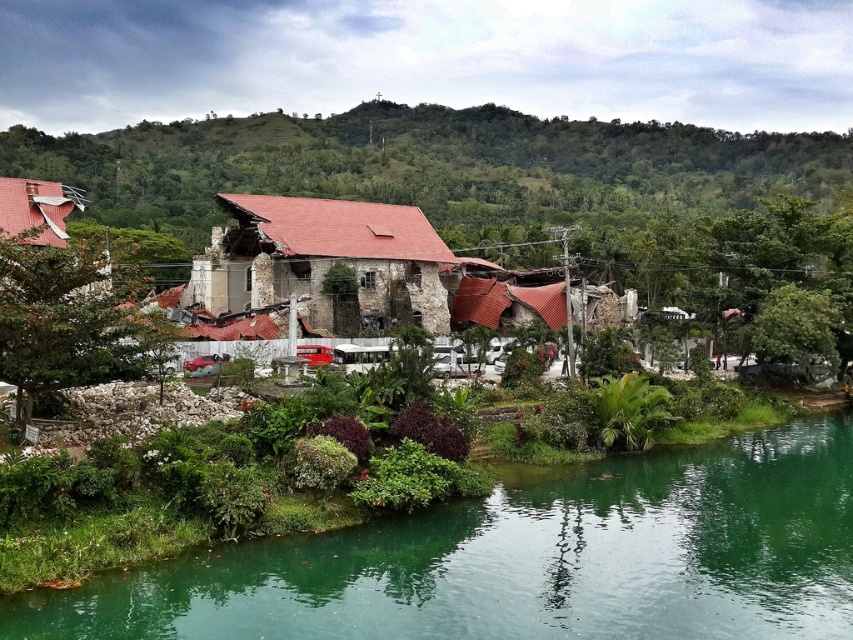
You are a drone operator trying to capture aerial footage of the demolished building. Your drone has a maximum flight range of 25 meters. If you are positioned at the camera location, can your drone reach the green smooth water at lower center without exceeding its range?

The distance between the green smooth water at lower center and the camera is 23.77 meters, which is within the drone operator drone has a maximum flight range of 25 meters. Therefore, the drone can safely reach the green smooth water at lower center without exceeding its range.

You are standing at the edge of the demolished building and want to take a photo of both the green smooth water at lower center and the green leafy hillside at upper center. Which object should you pan your camera to the right to include in the frame first?

You should pan your camera to the right to include the green smooth water at lower center first because it is positioned to the right of the green leafy hillside at upper center.

Consider the image. You are standing in front of the partially demolished building and want to take a photo that includes both point (200, 156) and point (294, 282). Which point will appear closer to the edge of the photo frame?

Point (294, 282) will appear closer to the edge of the photo frame because it is closer to the camera than point (200, 156), making it more likely to be near the frame edge depending on the camera angle and zoom.